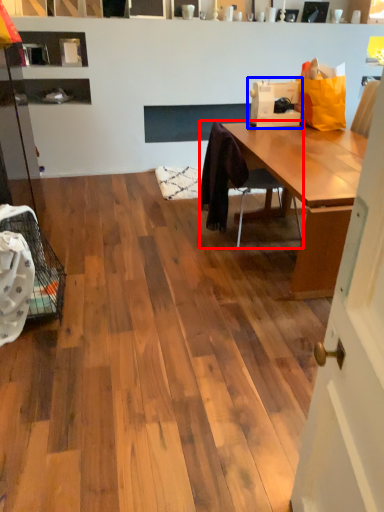
Question: Which of the following is the closest to the observer, chair (highlighted by a red box) or sewing machine (highlighted by a blue box)?

Choices:
 (A) chair
 (B) sewing machine

Answer: (A)